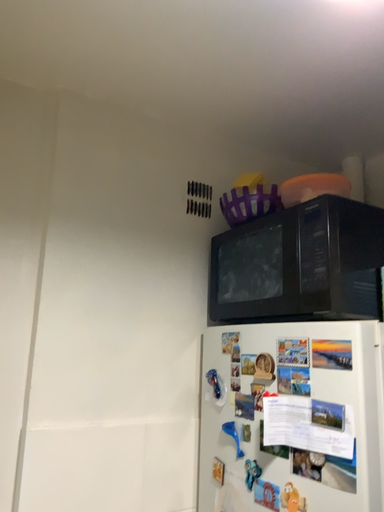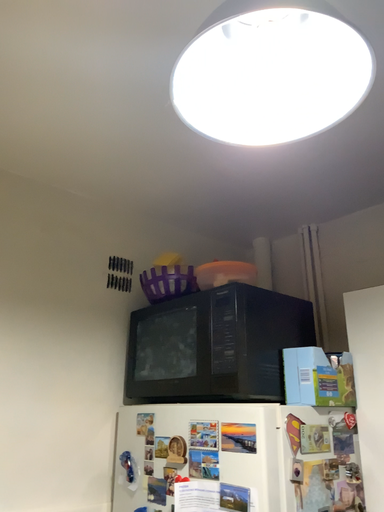
Question: Which way did the camera rotate in the video?

Choices:
 (A) rotated upward
 (B) rotated downward

Answer: (A)